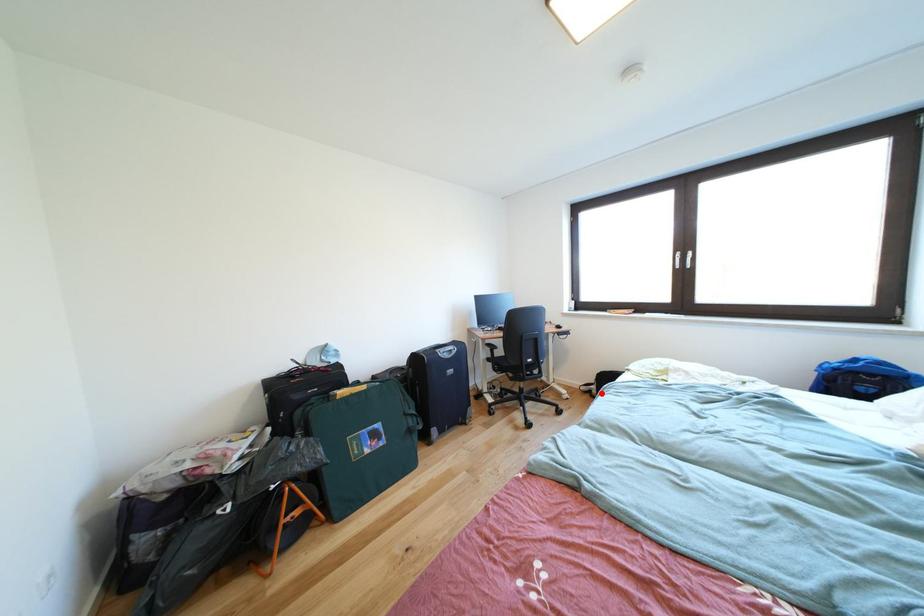
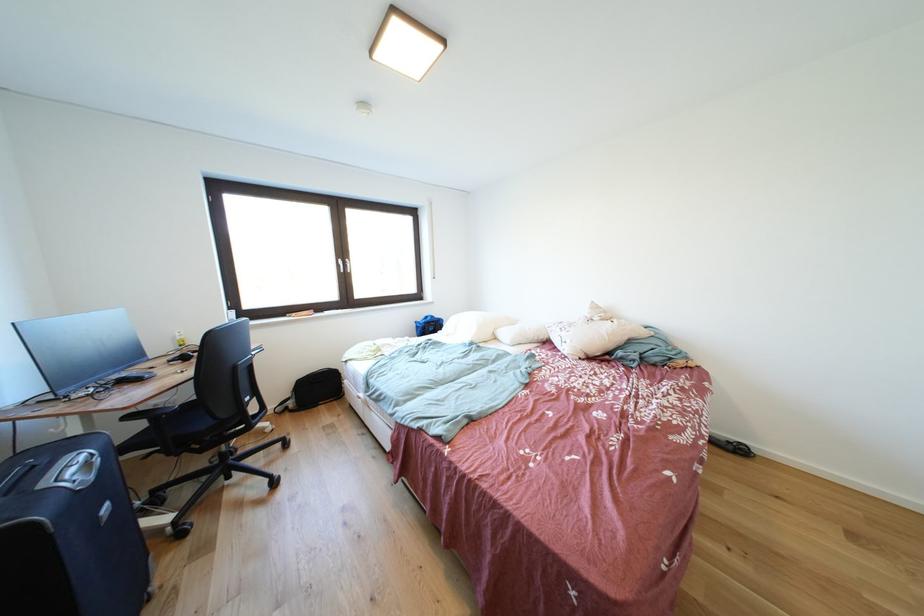
In the second image, find the point that corresponds to the highlighted location in the first image.

(299, 408)